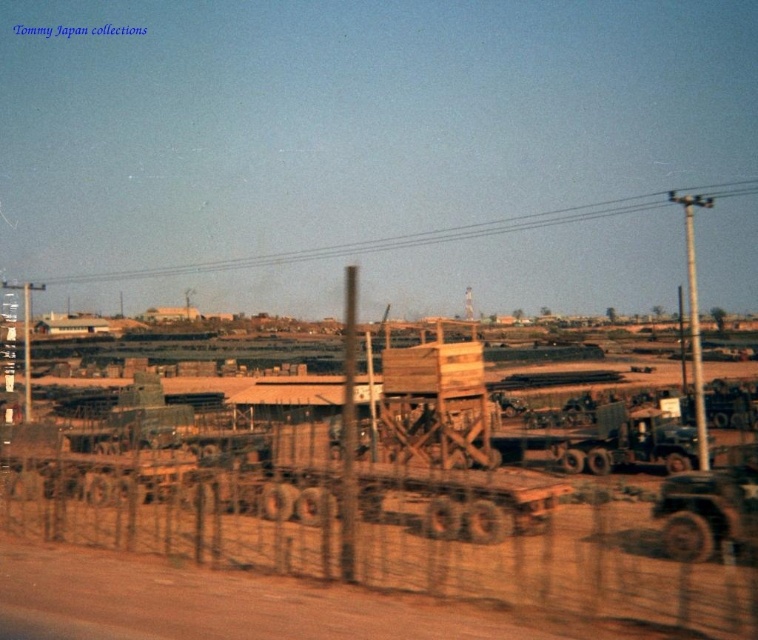
Question: Is wooden planks at center thinner than brown wire mesh fence at lower center?

Choices:
 (A) yes
 (B) no

Answer: (B)

Question: Which object is closer to the camera taking this photo?

Choices:
 (A) brown wire mesh fence at lower center
 (B) wooden planks at center

Answer: (A)

Question: From the image, what is the correct spatial relationship of wooden planks at center in relation to brown wire mesh fence at lower center?

Choices:
 (A) below
 (B) above

Answer: (B)

Question: Which object appears closest to the camera in this image?

Choices:
 (A) brown wire mesh fence at lower center
 (B) wooden planks at center

Answer: (A)

Question: Does wooden planks at center have a larger size compared to brown wire mesh fence at lower center?

Choices:
 (A) no
 (B) yes

Answer: (B)